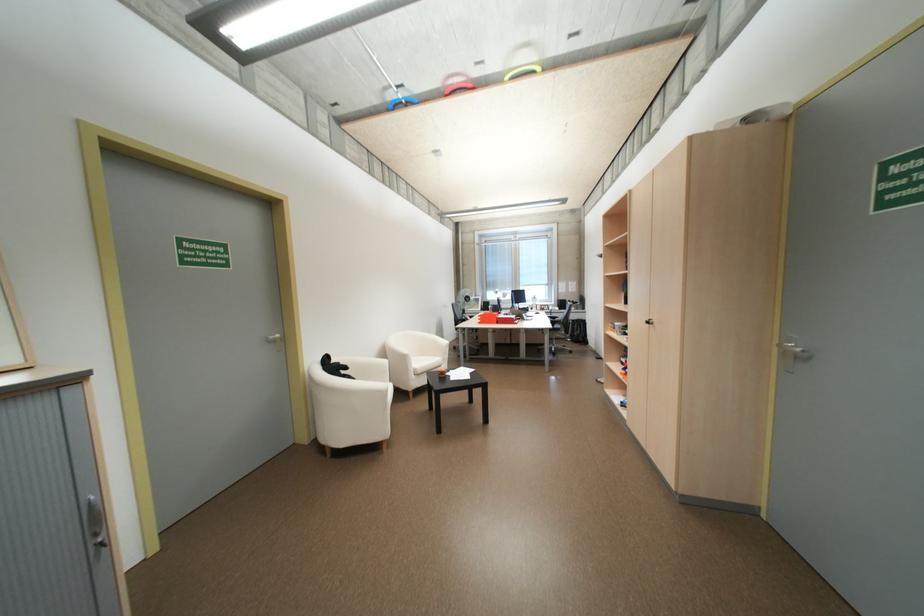
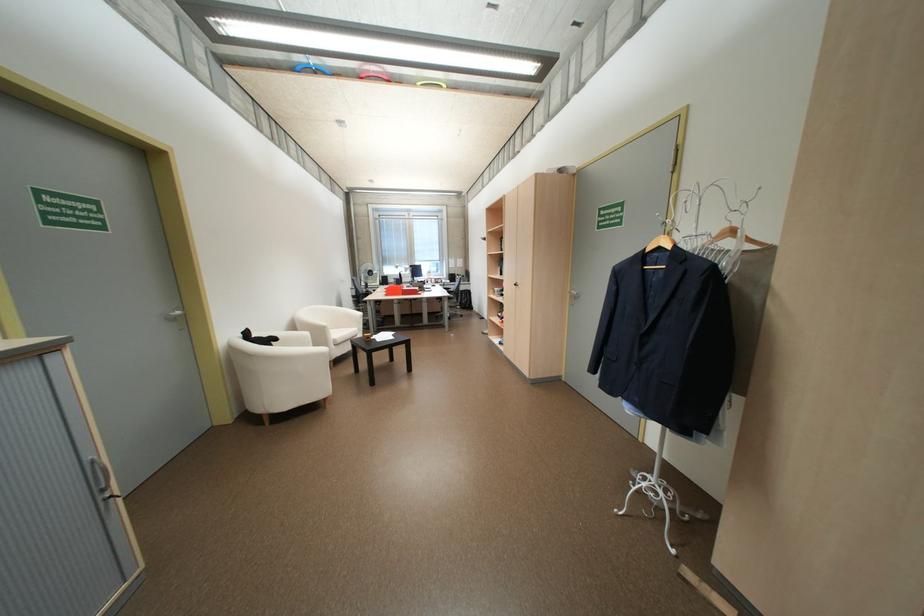
In the scene shown: What movement of the cameraman would produce the second image?

The cameraman walked toward left, backward.